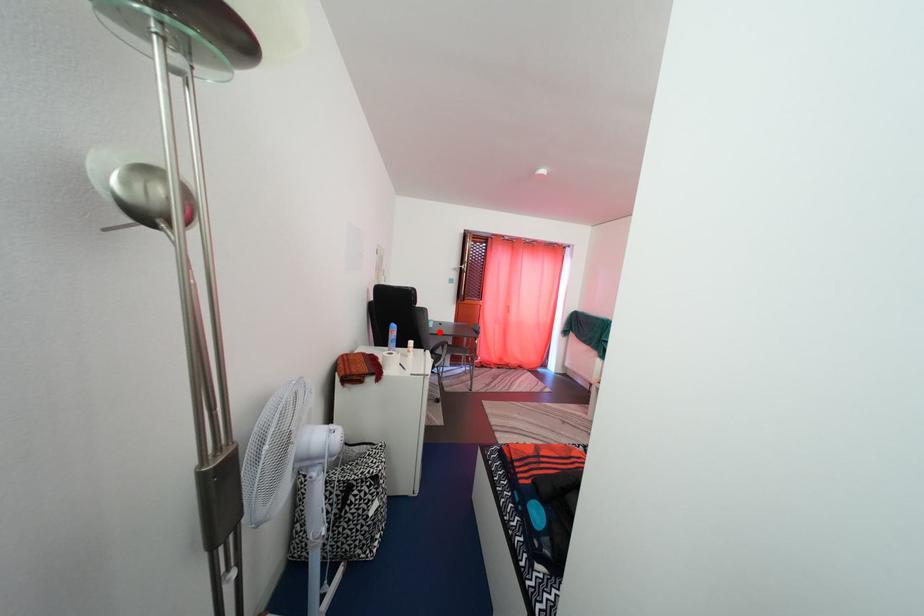
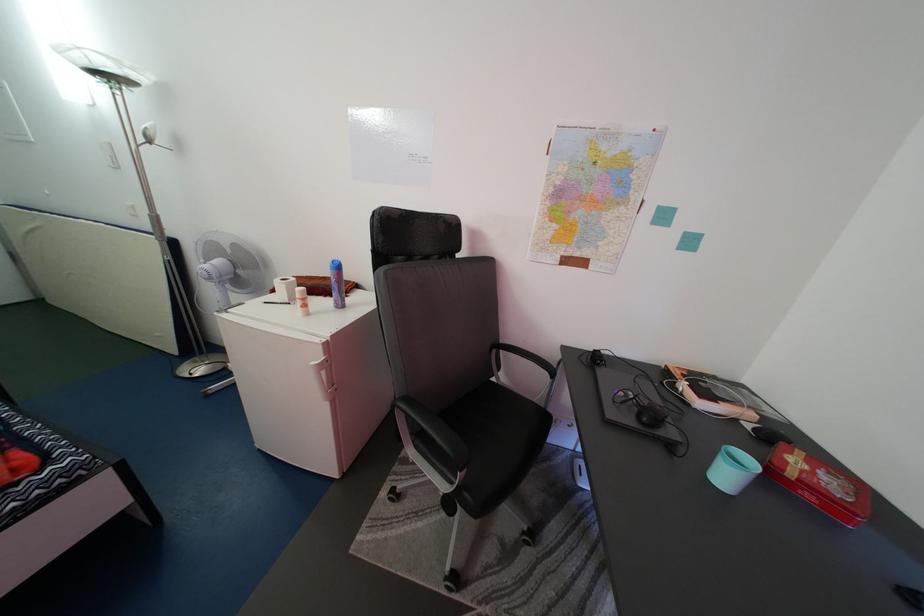
The point at the highlighted location is marked in the first image. Where is the corresponding point in the second image?

(735, 484)